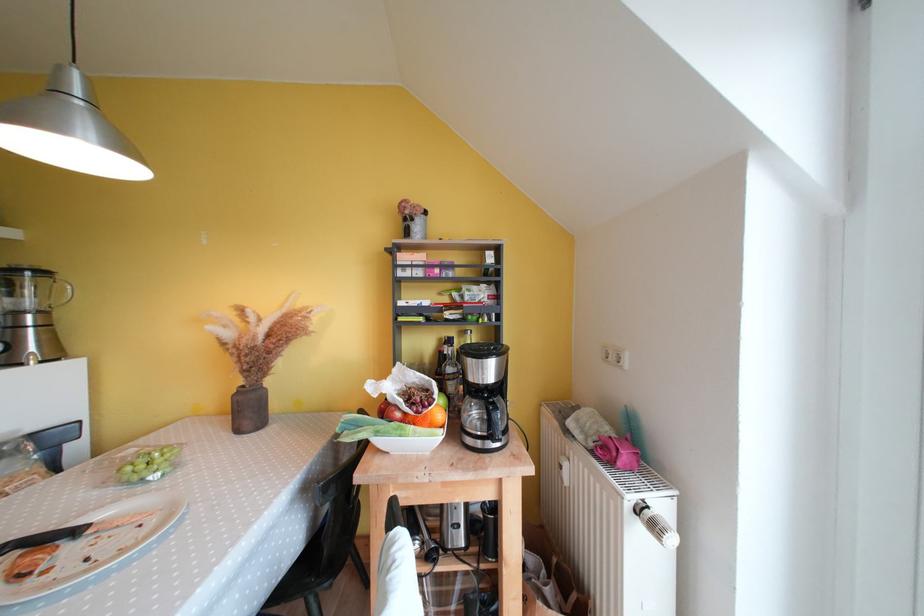
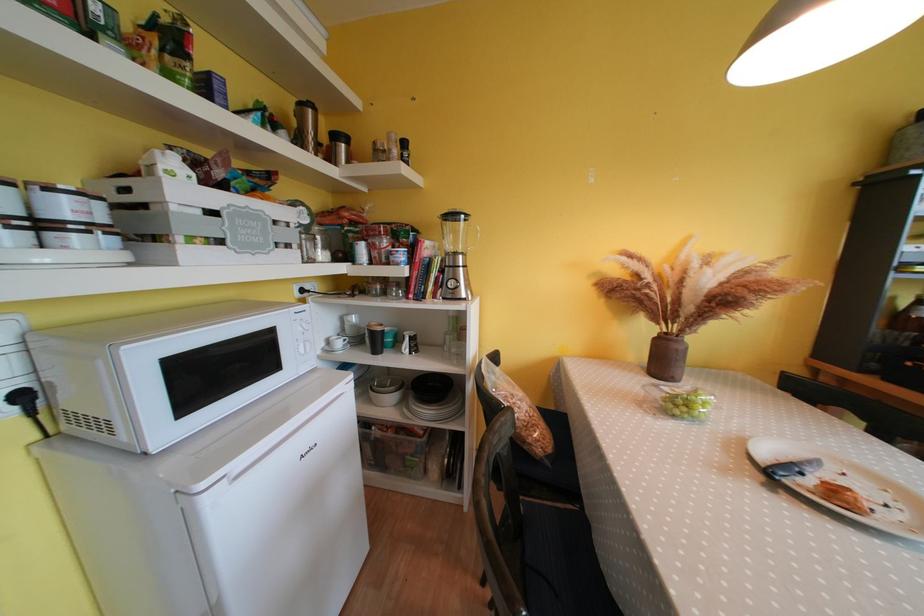
Question: The images are taken continuously from a first-person perspective. In which direction are you moving?

Choices:
 (A) Left
 (B) Right
 (C) Forward
 (D) Backward

Answer: (A)